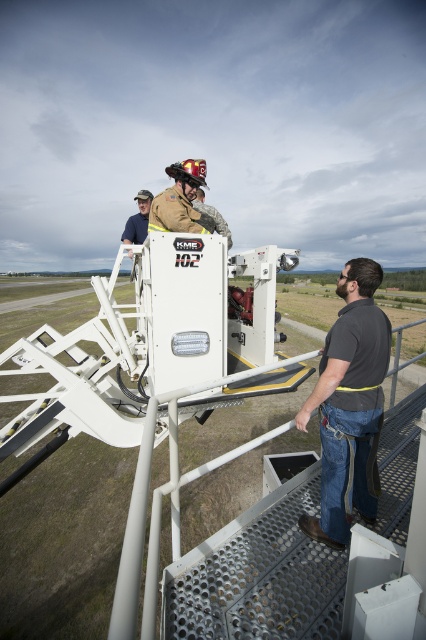
Based on the scene description, can you determine which object is taller between the dark gray shirt at center and the firefighter helmet at center?

The dark gray shirt at center is much taller than the firefighter helmet at center.

You are a safety inspector checking the equipment in the scene. You notice two points marked on the equipment. The first point is at coordinates point [327,337] and the second is at point [173,220]. From your vantage point, which point is closer to you?

Point [327,337] is in front of point [173,220], so the first point is closer to you.